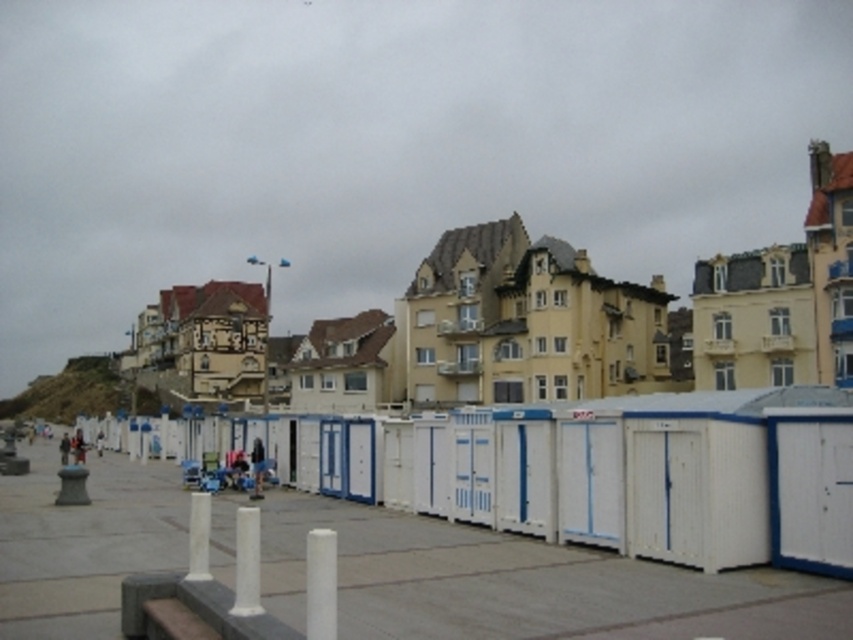
Can you confirm if white matte pole at center is smaller than white plastic pole at lower center?

Correct, white matte pole at center occupies less space than white plastic pole at lower center.

Identify the location of white matte pole at center. The image size is (853, 640). (320, 582).

Between point (256, 598) and point (207, 493), which one is positioned behind?

The point (207, 493) is more distant.

Is white plastic pole at lower center bigger than white smooth post at center?

Actually, white plastic pole at lower center might be smaller than white smooth post at center.

Is point (241, 602) behind point (199, 513)?

No.

At what (x,y) coordinates should I click in order to perform the action: click on white plastic pole at lower center. Please return your answer as a coordinate pair (x, y). The width and height of the screenshot is (853, 640). Looking at the image, I should click on (247, 563).

Is point (430, 323) positioned before point (744, 371)?

No, (430, 323) is further to viewer.

Is beige wooden beach hut at center positioned at the back of white painted wood beach hut at center?

Yes, beige wooden beach hut at center is further from the viewer.

The width and height of the screenshot is (853, 640). What do you see at coordinates (527, 323) in the screenshot?
I see `beige wooden beach hut at center` at bounding box center [527, 323].

This screenshot has width=853, height=640. I want to click on beige wooden beach hut at center, so click(527, 323).